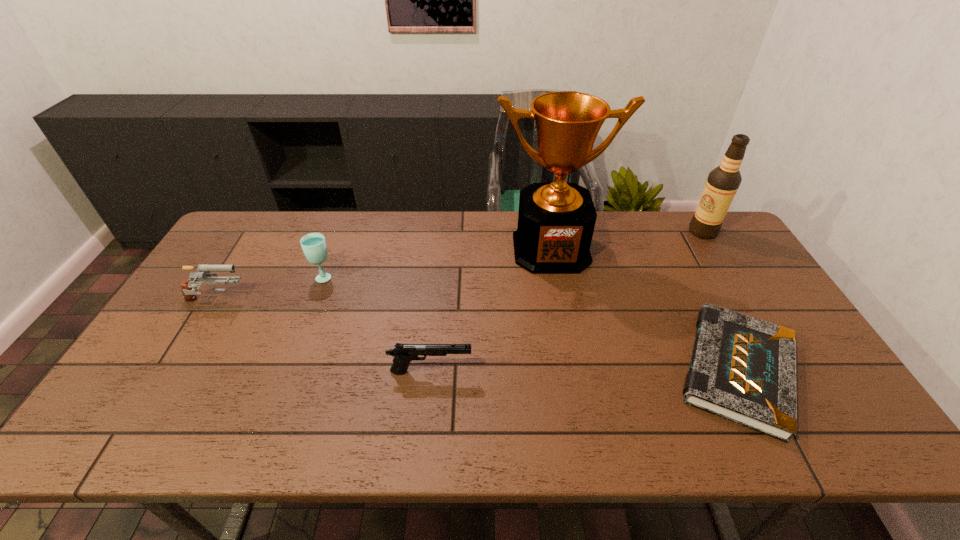
You are a GUI agent. You are given a task and a screenshot of the screen. Output one action in this format:
    pyautogui.click(x=<x>, y=<y>)
    Task: Click on the vacant space located on the label of the alcohol
    The height and width of the screenshot is (540, 960).
    Given the screenshot: What is the action you would take?
    pyautogui.click(x=660, y=232)

Where is `free space located on the label of the alcohol`? free space located on the label of the alcohol is located at coordinates (599, 232).

You are a GUI agent. You are given a task and a screenshot of the screen. Output one action in this format:
    pyautogui.click(x=<x>, y=<y>)
    Task: Click on the free space located on the label of the alcohol
    
    Given the screenshot: What is the action you would take?
    pos(636,232)

Identify the location of free location located 0.100m on the right of the glass. (367, 276).

You are a GUI agent. You are given a task and a screenshot of the screen. Output one action in this format:
    pyautogui.click(x=<x>, y=<y>)
    Task: Click on the vacant region located 0.090m at the barrel end of the taller gun
    
    Given the screenshot: What is the action you would take?
    pyautogui.click(x=277, y=302)

I want to click on vacant space located 0.400m at the aiming end of the right gun, so click(631, 372).

The height and width of the screenshot is (540, 960). What are the coordinates of `vacant position located on the back of the notebook` in the screenshot? It's located at point(676,248).

Locate an element on the screen. The image size is (960, 540). trophy cup present at the far edge is located at coordinates (556, 221).

In order to click on alcohol at the far edge in this screenshot , I will do `click(723, 182)`.

Locate an element on the screen. object present at the near edge is located at coordinates (743, 369).